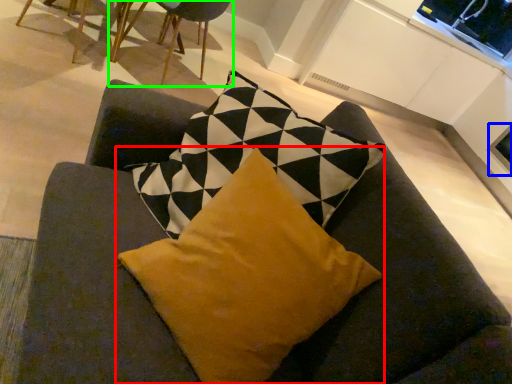
Question: Which object is positioned farthest from pillow (highlighted by a red box)? Select from window screen (highlighted by a blue box) and chair (highlighted by a green box).

Choices:
 (A) window screen
 (B) chair

Answer: (A)